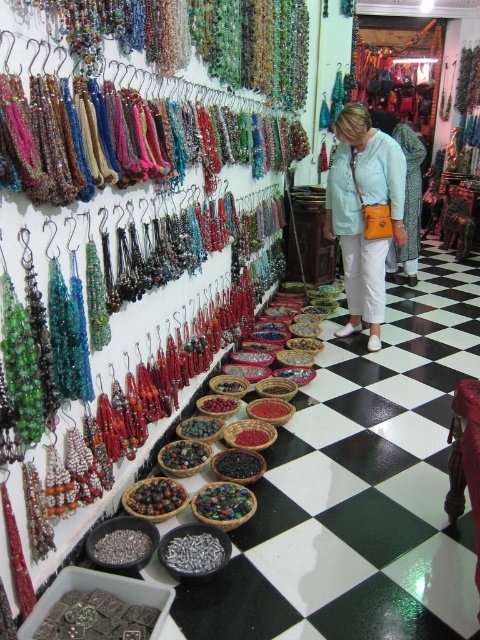
Looking at this image, between light blue fabric shirt at center and silver metallic bracelet at center, which one appears on the left side from the viewer's perspective?

light blue fabric shirt at center

The image size is (480, 640). Identify the location of light blue fabric shirt at center. (362, 212).

The image size is (480, 640). I want to click on light blue fabric shirt at center, so click(362, 212).